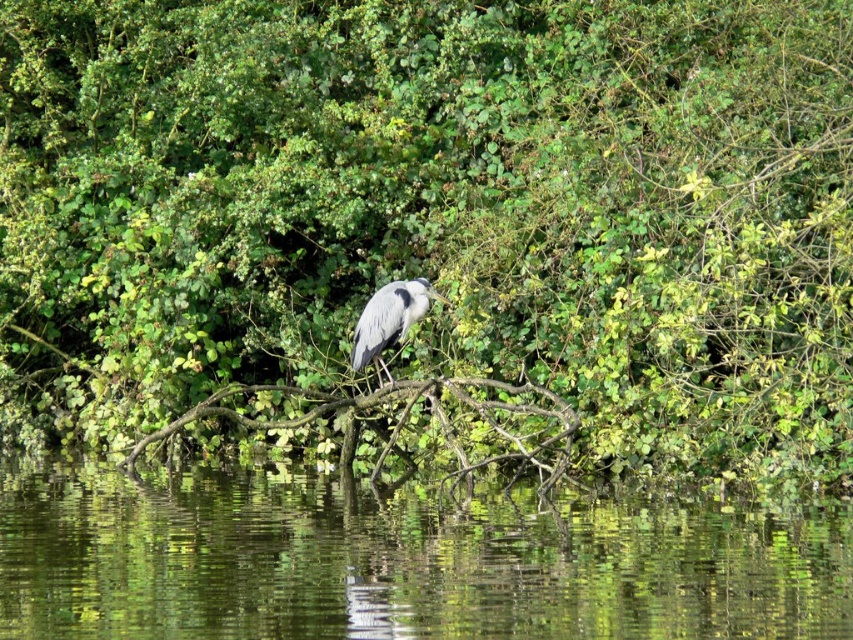
You are an ornithologist observing the gray matte heron at center and the transparent water at center in the image. Which object occupies a larger area in the scene?

The transparent water at center is bigger than the gray matte heron at center, so the transparent water at center occupies a larger area in the scene.

You are a birdwatcher observing the scene. You notice the transparent water at center and the brown rough tree branch at center. Which object is positioned to the right side of the other?

The transparent water at center is to the left of brown rough tree branch at center, so the brown rough tree branch at center is positioned to the right of the transparent water at center.

You are a birdwatcher observing the gray matte heron at center and the brown rough tree branch at center in the scene. Which object is positioned to the right side of the other?

The brown rough tree branch at center is positioned to the right of the gray matte heron at center.